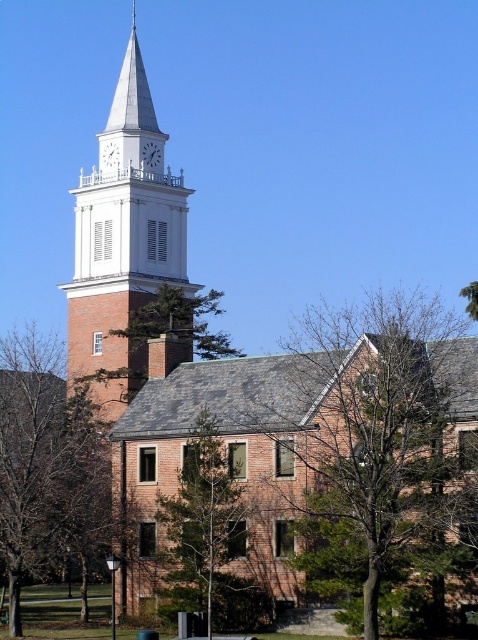
Can you confirm if green leafy tree at center is taller than white clock tower at upper center?

Indeed, green leafy tree at center has a greater height compared to white clock tower at upper center.

Can you confirm if green leafy tree at center is positioned below white clock tower at upper center?

Indeed, green leafy tree at center is positioned under white clock tower at upper center.

I want to click on green leafy tree at center, so click(x=206, y=518).

Where is `green leafy tree at center`? The image size is (478, 640). green leafy tree at center is located at coordinates tap(206, 518).

Who is shorter, green leafy tree at center or green leafy tree at upper center?

Standing shorter between the two is green leafy tree at upper center.

Which is in front, point (217, 522) or point (204, 310)?

Positioned in front is point (217, 522).

Identify the location of green leafy tree at center. The image size is (478, 640). (206, 518).

How much distance is there between white brick clock tower at upper left and green leafy tree at center?

43.51 meters

Is point (121, 305) farther from viewer compared to point (212, 420)?

Yes.

Identify the location of white brick clock tower at upper left. The width and height of the screenshot is (478, 640). (122, 244).

Locate an element on the screen. white brick clock tower at upper left is located at coordinates (122, 244).